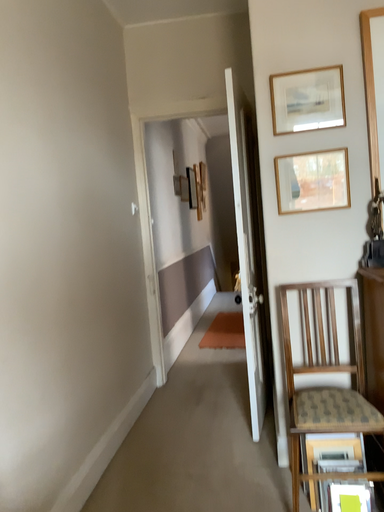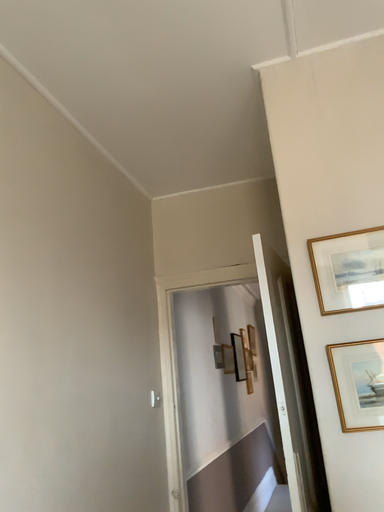
Question: Which way did the camera rotate in the video?

Choices:
 (A) rotated right
 (B) rotated left

Answer: (B)